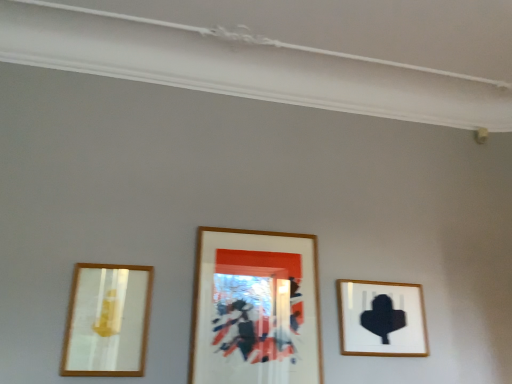
Find the location of a particular element. wooden framed artwork at center, the second picture frame when ordered from left to right is located at coordinates (255, 308).

This screenshot has width=512, height=384. What do you see at coordinates (255, 308) in the screenshot? I see `wooden framed artwork at center, the second picture frame positioned from the right` at bounding box center [255, 308].

Locate an element on the screen. This screenshot has width=512, height=384. matte black silhouette at right, which is counted as the first picture frame, starting from the right is located at coordinates (381, 319).

The height and width of the screenshot is (384, 512). In order to click on matte gold mirror at left, arranged as the third picture frame when viewed from the right in this screenshot , I will do `click(106, 321)`.

From the picture: From the image's perspective, is matte black silhouette at right, which is counted as the first picture frame, starting from the right, above wooden framed artwork at center, the second picture frame positioned from the right?

Incorrect, from the image's perspective, matte black silhouette at right, which is counted as the first picture frame, starting from the right, is lower than wooden framed artwork at center, the second picture frame positioned from the right.

Considering the relative sizes of matte black silhouette at right, the 3th picture frame when ordered from left to right, and wooden framed artwork at center, the second picture frame positioned from the right, in the image provided, is matte black silhouette at right, the 3th picture frame when ordered from left to right, thinner than wooden framed artwork at center, the second picture frame positioned from the right,?

In fact, matte black silhouette at right, the 3th picture frame when ordered from left to right, might be wider than wooden framed artwork at center, the second picture frame positioned from the right.

Would you say matte black silhouette at right, the 3th picture frame when ordered from left to right, is outside wooden framed artwork at center, the second picture frame when ordered from left to right?

matte black silhouette at right, the 3th picture frame when ordered from left to right, is positioned outside wooden framed artwork at center, the second picture frame when ordered from left to right.

Is matte black silhouette at right, which is counted as the first picture frame, starting from the right, to the left or to the right of wooden framed artwork at center, the second picture frame positioned from the right, in the image?

Based on their positions, matte black silhouette at right, which is counted as the first picture frame, starting from the right, is located to the right of wooden framed artwork at center, the second picture frame positioned from the right.

Does point (287, 305) come in front of point (76, 317)?

No, (287, 305) is behind (76, 317).

From a real-world perspective, which is physically below, wooden framed artwork at center, the second picture frame positioned from the right, or matte gold mirror at left, arranged as the first picture frame when viewed from the left?

matte gold mirror at left, arranged as the first picture frame when viewed from the left, from a real-world perspective.

Who is smaller, wooden framed artwork at center, the second picture frame positioned from the right, or matte gold mirror at left, arranged as the first picture frame when viewed from the left?

matte gold mirror at left, arranged as the first picture frame when viewed from the left, is smaller.

At what (x,y) coordinates should I click in order to perform the action: click on picture frame that is the 1st one when counting rightward from the matte gold mirror at left, arranged as the first picture frame when viewed from the left. Please return your answer as a coordinate pair (x, y). Looking at the image, I should click on (255, 308).

Is matte gold mirror at left, arranged as the third picture frame when viewed from the right, outside of matte black silhouette at right, the 3th picture frame when ordered from left to right?

Absolutely, matte gold mirror at left, arranged as the third picture frame when viewed from the right, is external to matte black silhouette at right, the 3th picture frame when ordered from left to right.

Considering the positions of objects matte gold mirror at left, arranged as the third picture frame when viewed from the right, and matte black silhouette at right, which is counted as the first picture frame, starting from the right, in the image provided, who is more to the left, matte gold mirror at left, arranged as the third picture frame when viewed from the right, or matte black silhouette at right, which is counted as the first picture frame, starting from the right,?

Positioned to the left is matte gold mirror at left, arranged as the third picture frame when viewed from the right.

From the image's perspective, between matte gold mirror at left, arranged as the third picture frame when viewed from the right, and matte black silhouette at right, which is counted as the first picture frame, starting from the right, who is located below?

matte black silhouette at right, which is counted as the first picture frame, starting from the right.

How many degrees apart are the facing directions of matte black silhouette at right, the 3th picture frame when ordered from left to right, and matte gold mirror at left, arranged as the third picture frame when viewed from the right?

They differ by 0.00179 degrees in their facing directions.

From a real-world perspective, does matte black silhouette at right, the 3th picture frame when ordered from left to right, sit lower than matte gold mirror at left, arranged as the first picture frame when viewed from the left?

Incorrect, from a real-world perspective, matte black silhouette at right, the 3th picture frame when ordered from left to right, is higher than matte gold mirror at left, arranged as the first picture frame when viewed from the left.

Is matte black silhouette at right, the 3th picture frame when ordered from left to right, taller or shorter than matte gold mirror at left, arranged as the third picture frame when viewed from the right?

Considering their sizes, matte black silhouette at right, the 3th picture frame when ordered from left to right, has less height than matte gold mirror at left, arranged as the third picture frame when viewed from the right.

Is matte black silhouette at right, the 3th picture frame when ordered from left to right, positioned behind matte gold mirror at left, arranged as the third picture frame when viewed from the right?

Yes, matte black silhouette at right, the 3th picture frame when ordered from left to right, is further from the camera.

Based on the photo, from the image's perspective, is matte gold mirror at left, arranged as the third picture frame when viewed from the right, above or below wooden framed artwork at center, the second picture frame when ordered from left to right?

Based on their image positions, matte gold mirror at left, arranged as the third picture frame when viewed from the right, is located beneath wooden framed artwork at center, the second picture frame when ordered from left to right.

Considering the positions of objects matte gold mirror at left, arranged as the first picture frame when viewed from the left, and wooden framed artwork at center, the second picture frame positioned from the right, in the image provided, who is more to the right, matte gold mirror at left, arranged as the first picture frame when viewed from the left, or wooden framed artwork at center, the second picture frame positioned from the right,?

wooden framed artwork at center, the second picture frame positioned from the right.

How different are the orientations of matte gold mirror at left, arranged as the first picture frame when viewed from the left, and wooden framed artwork at center, the second picture frame positioned from the right, in degrees?

There is a 0.00295-degree angle between the facing directions of matte gold mirror at left, arranged as the first picture frame when viewed from the left, and wooden framed artwork at center, the second picture frame positioned from the right.

Between matte gold mirror at left, arranged as the first picture frame when viewed from the left, and wooden framed artwork at center, the second picture frame when ordered from left to right, which one has smaller size?

matte gold mirror at left, arranged as the first picture frame when viewed from the left.

Is wooden framed artwork at center, the second picture frame when ordered from left to right, not within matte black silhouette at right, the 3th picture frame when ordered from left to right?

wooden framed artwork at center, the second picture frame when ordered from left to right, lies outside matte black silhouette at right, the 3th picture frame when ordered from left to right,'s area.

Is wooden framed artwork at center, the second picture frame positioned from the right, positioned before matte black silhouette at right, the 3th picture frame when ordered from left to right?

Yes, the depth of wooden framed artwork at center, the second picture frame positioned from the right, is less than that of matte black silhouette at right, the 3th picture frame when ordered from left to right.

How many degrees apart are the facing directions of wooden framed artwork at center, the second picture frame when ordered from left to right, and matte black silhouette at right, the 3th picture frame when ordered from left to right?

They differ by 0.00225 degrees in their facing directions.

Based on the photo, is wooden framed artwork at center, the second picture frame when ordered from left to right, at the left side of matte black silhouette at right, which is counted as the first picture frame, starting from the right?

Yes, wooden framed artwork at center, the second picture frame when ordered from left to right, is to the left of matte black silhouette at right, which is counted as the first picture frame, starting from the right.

At what (x,y) coordinates should I click in order to perform the action: click on the 2nd picture frame below the wooden framed artwork at center, the second picture frame when ordered from left to right (from the image's perspective). Please return your answer as a coordinate pair (x, y). Image resolution: width=512 pixels, height=384 pixels. Looking at the image, I should click on tap(381, 319).

From a real-world perspective, count 2nd picture frames downward from the wooden framed artwork at center, the second picture frame positioned from the right, and point to it. Please provide its 2D coordinates.

[(106, 321)]

Based on their spatial positions, is matte gold mirror at left, arranged as the third picture frame when viewed from the right, or wooden framed artwork at center, the second picture frame positioned from the right, closer to matte black silhouette at right, the 3th picture frame when ordered from left to right?

wooden framed artwork at center, the second picture frame positioned from the right, is closer to matte black silhouette at right, the 3th picture frame when ordered from left to right.

Estimate the real-world distances between objects in this image. Which object is further from matte gold mirror at left, arranged as the third picture frame when viewed from the right, matte black silhouette at right, which is counted as the first picture frame, starting from the right, or wooden framed artwork at center, the second picture frame positioned from the right?

matte black silhouette at right, which is counted as the first picture frame, starting from the right, is positioned further to the anchor matte gold mirror at left, arranged as the third picture frame when viewed from the right.

Considering their positions, is matte gold mirror at left, arranged as the third picture frame when viewed from the right, positioned closer to wooden framed artwork at center, the second picture frame when ordered from left to right, than matte black silhouette at right, the 3th picture frame when ordered from left to right?

Among the two, matte black silhouette at right, the 3th picture frame when ordered from left to right, is located nearer to wooden framed artwork at center, the second picture frame when ordered from left to right.

Considering their positions, is matte black silhouette at right, the 3th picture frame when ordered from left to right, positioned closer to wooden framed artwork at center, the second picture frame when ordered from left to right, than matte gold mirror at left, arranged as the first picture frame when viewed from the left?

Among the two, matte black silhouette at right, the 3th picture frame when ordered from left to right, is located nearer to wooden framed artwork at center, the second picture frame when ordered from left to right.

Which object lies further to the anchor point matte gold mirror at left, arranged as the first picture frame when viewed from the left, wooden framed artwork at center, the second picture frame when ordered from left to right, or matte black silhouette at right, which is counted as the first picture frame, starting from the right?

matte black silhouette at right, which is counted as the first picture frame, starting from the right, is further to matte gold mirror at left, arranged as the first picture frame when viewed from the left.

Considering their positions, is wooden framed artwork at center, the second picture frame when ordered from left to right, positioned further to matte black silhouette at right, which is counted as the first picture frame, starting from the right, than matte gold mirror at left, arranged as the first picture frame when viewed from the left?

matte gold mirror at left, arranged as the first picture frame when viewed from the left, is positioned further to the anchor matte black silhouette at right, which is counted as the first picture frame, starting from the right.

This screenshot has width=512, height=384. I want to click on picture frame between matte gold mirror at left, arranged as the first picture frame when viewed from the left, and matte black silhouette at right, the 3th picture frame when ordered from left to right, so click(x=255, y=308).